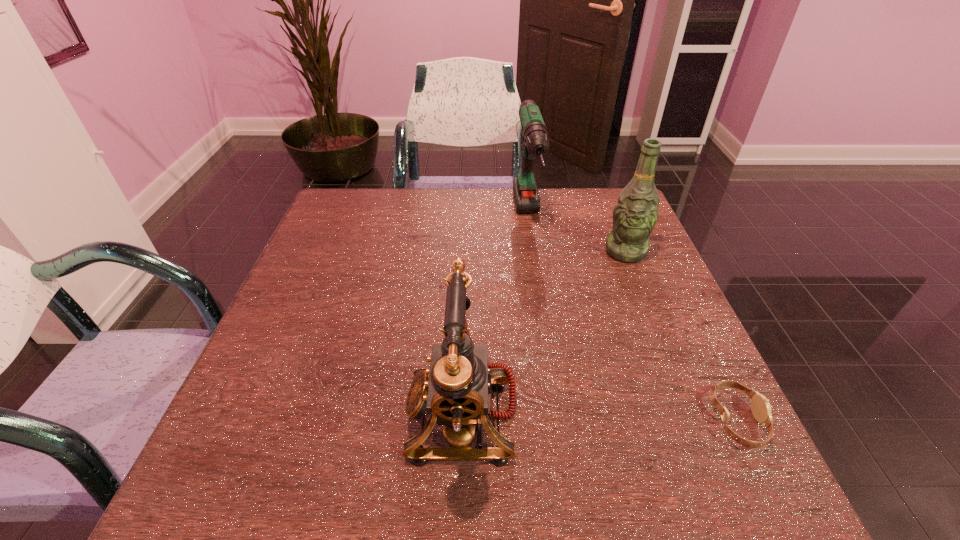
Find the location of a particular element. vacant area located 0.250m on the handle side of the drill is located at coordinates (547, 327).

At what (x,y) coordinates should I click in order to perform the action: click on free location located 0.140m on the handle side of the drill. Please return your answer as a coordinate pair (x, y). Image resolution: width=960 pixels, height=540 pixels. Looking at the image, I should click on (540, 292).

Locate an element on the screen. The height and width of the screenshot is (540, 960). free space located 0.170m on the handle side of the drill is located at coordinates (542, 301).

This screenshot has height=540, width=960. Find the location of `object at the far edge`. object at the far edge is located at coordinates (535, 135).

Where is `telephone that is at the near edge`? This screenshot has width=960, height=540. telephone that is at the near edge is located at coordinates (456, 390).

The image size is (960, 540). I want to click on watch present at the near edge, so click(x=760, y=406).

This screenshot has height=540, width=960. In order to click on watch that is positioned at the right edge in this screenshot , I will do `click(760, 406)`.

The image size is (960, 540). Identify the location of beer bottle that is positioned at the right edge. (635, 214).

The image size is (960, 540). In order to click on object at the near right corner in this screenshot , I will do `click(760, 406)`.

Identify the location of vacant space at the far edge of the desktop. (456, 218).